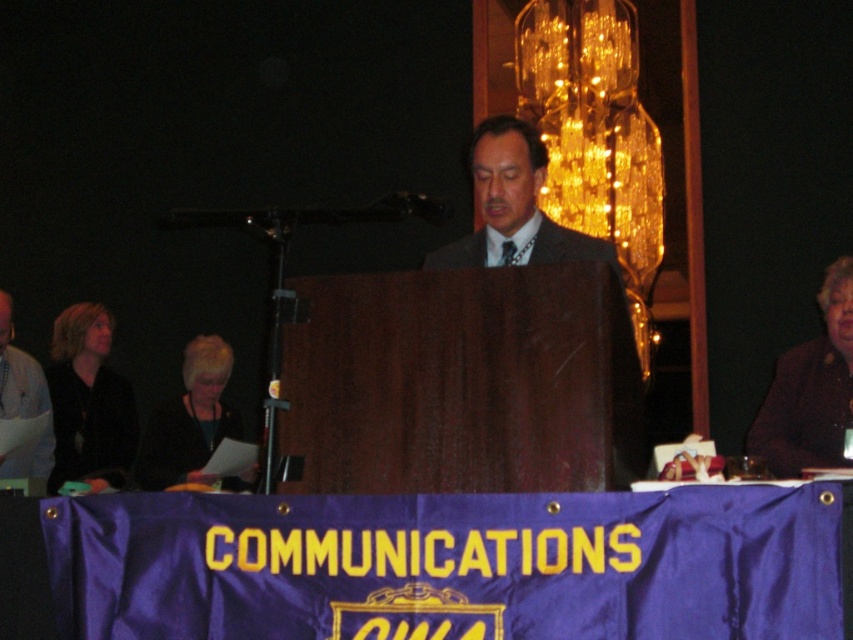
Question: Does dark gray suit at center come behind dark brown hair at lower left?

Choices:
 (A) no
 (B) yes

Answer: (A)

Question: Observing the image, what is the correct spatial positioning of dark brown fabric at right in reference to dark brown hair at left?

Choices:
 (A) left
 (B) right

Answer: (B)

Question: Which point is closer to the camera?

Choices:
 (A) matte black jacket at lower left
 (B) purple fabric banner at center
 (C) dark brown hair at left

Answer: (B)

Question: Can you confirm if dark brown hair at lower left is wider than purple fabric banner at center?

Choices:
 (A) no
 (B) yes

Answer: (A)

Question: Which of the following is the farthest from the observer?

Choices:
 (A) purple fabric banner at center
 (B) dark brown hair at lower left
 (C) dark brown hair at left

Answer: (C)

Question: Which of these objects is positioned farthest from the dark brown hair at left?

Choices:
 (A) dark brown fabric at right
 (B) matte black jacket at lower left

Answer: (A)